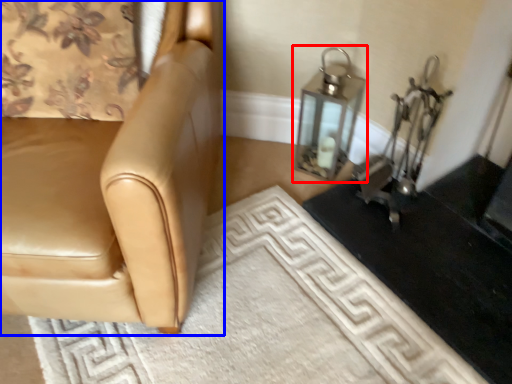
Question: Which point is further to the camera, oil lamp (highlighted by a red box) or chair (highlighted by a blue box)?

Choices:
 (A) oil lamp
 (B) chair

Answer: (A)